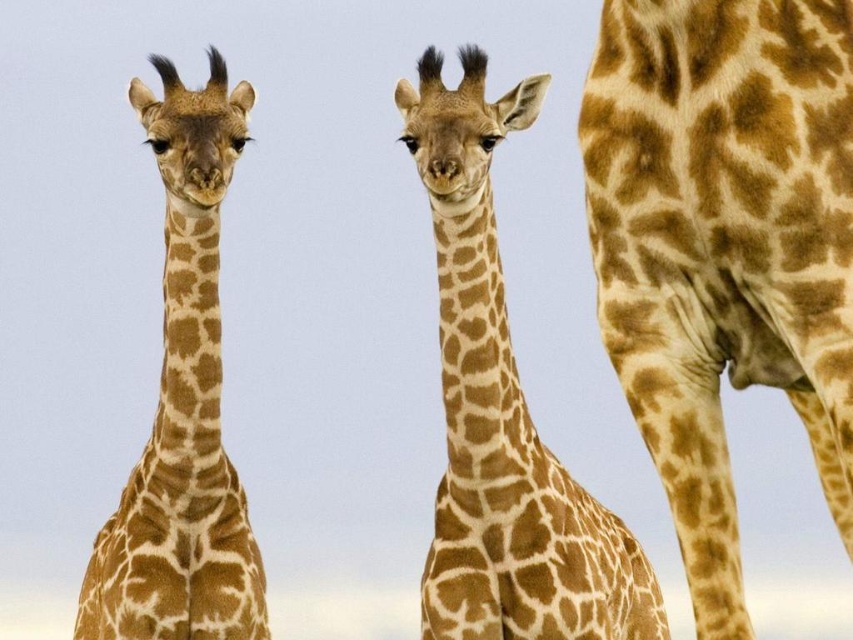
From the picture: Can you confirm if spotted fur giraffe at right is positioned above spotted brown giraffe at center?

Yes, spotted fur giraffe at right is above spotted brown giraffe at center.

Which is below, spotted fur giraffe at right or spotted brown giraffe at center?

Positioned lower is spotted brown giraffe at center.

Does point (741, 204) come farther from viewer compared to point (206, 285)?

No, it is in front of (206, 285).

I want to click on spotted fur giraffe at right, so click(723, 246).

Who is more distant from viewer, (547, 468) or (212, 550)?

The point (547, 468) is more distant.

Can you confirm if spotted fur giraffe at center is wider than spotted brown giraffe at center?

Yes, spotted fur giraffe at center is wider than spotted brown giraffe at center.

The height and width of the screenshot is (640, 853). I want to click on spotted fur giraffe at center, so coord(502,412).

Find the location of a particular element. This screenshot has height=640, width=853. spotted fur giraffe at center is located at coordinates (502, 412).

Is spotted fur giraffe at right thinner than spotted fur giraffe at center?

Indeed, spotted fur giraffe at right has a lesser width compared to spotted fur giraffe at center.

Is point (810, 268) closer to viewer compared to point (457, 225)?

Yes, point (810, 268) is closer to viewer.

Identify the location of spotted fur giraffe at right. The width and height of the screenshot is (853, 640). 723,246.